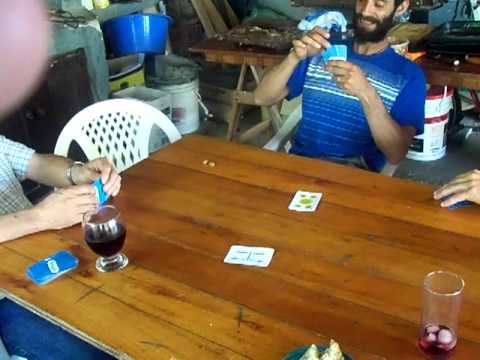
Locate an element on the screen. This screenshot has width=480, height=360. wine glass is located at coordinates (104, 245), (437, 324).